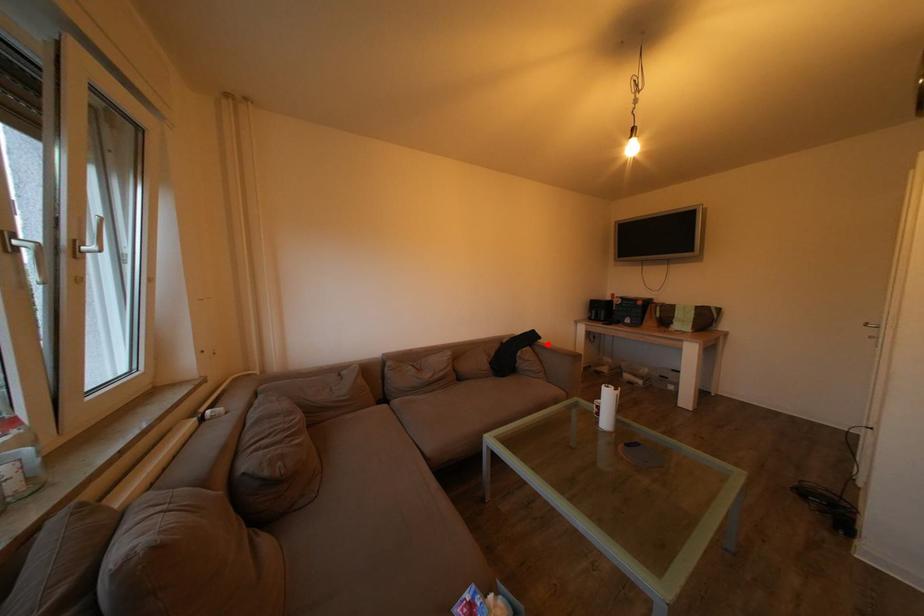
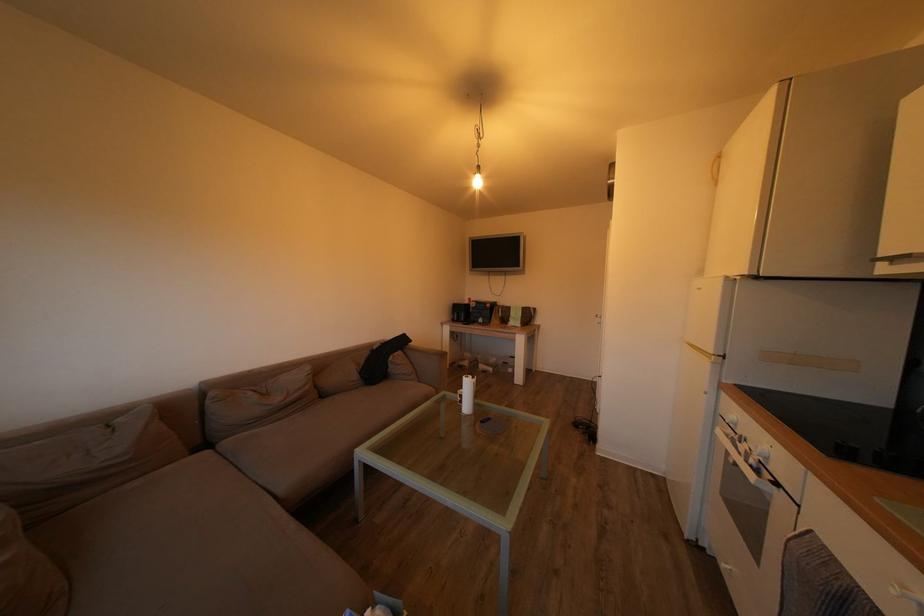
Find the pixel in the second image that matches the highlighted location in the first image.

(419, 347)